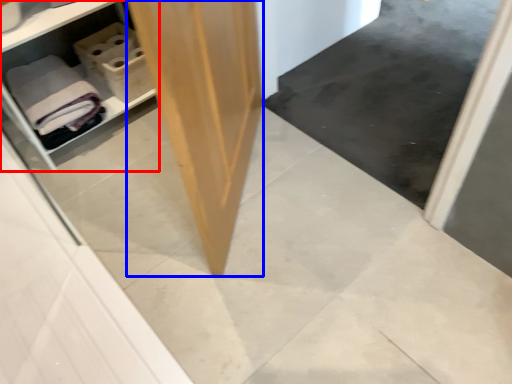
Question: Which object is closer to the camera taking this photo, shelf (highlighted by a red box) or plywood (highlighted by a blue box)?

Choices:
 (A) shelf
 (B) plywood

Answer: (B)